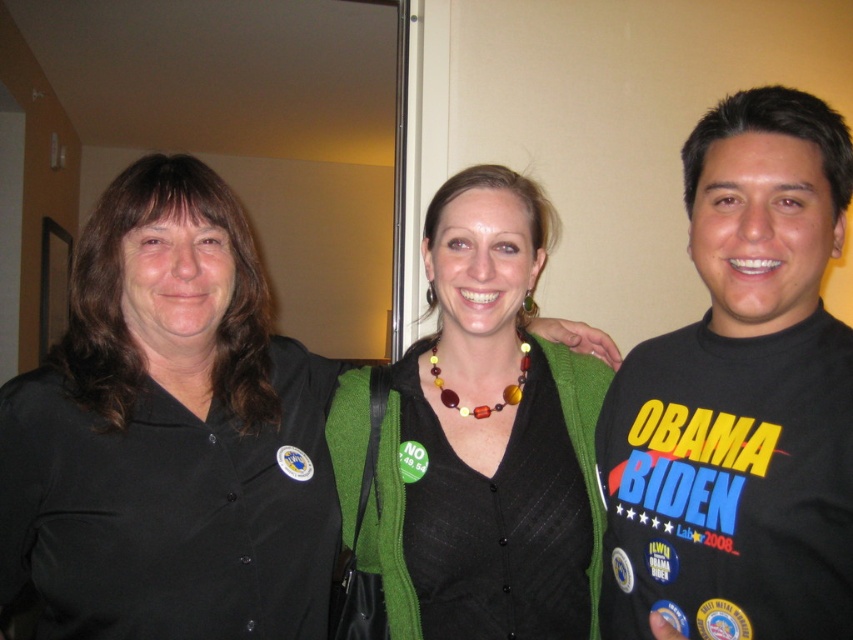
You are a photographer standing in front of the three people in the image. You want to take a closeup shot of the multicolored beads necklace at center without including the black matte shirt at center in the frame. Is this possible given their current positions?

The distance between the black matte shirt at center and the multicolored beads necklace at center is 12.98 inches. Since the photographer can adjust the camera angle or zoom to focus solely on the necklace while excluding the shirt, it is possible to take the closeup shot without including the black matte shirt at center.

You are a photographer trying to capture a clear shot of the multicolored beads necklace at center while ensuring the black matte shirt at center doesn t block the view. Based on their relative sizes, is it possible to adjust your angle so the necklace is fully visible without the shirt obstructing it?

The black matte shirt at center is taller than the multicolored beads necklace at center, so adjusting the angle downward might allow the necklace to be fully visible without obstruction from the shirt.

You are standing in front of the three people in the image. You want to hand a gift to the person wearing the black matte shirt at center without accidentally giving it to the person in the green fabric sweater at center. Based on their positions, which one should you approach first?

The black matte shirt at center is closer to the viewer than the green fabric sweater at center, so you should approach the person wearing the black matte shirt at center first to ensure you hand the gift correctly without confusion.